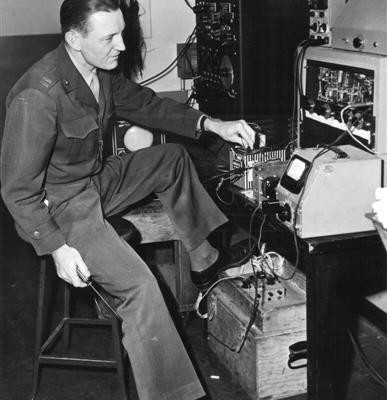
Identify the location of black thin table. The height and width of the screenshot is (400, 387). pyautogui.click(x=319, y=247).